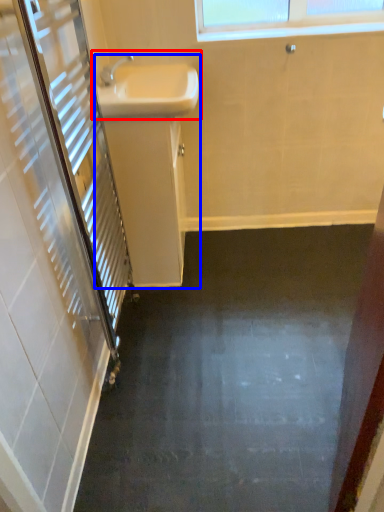
Question: Which of the following is the closest to the observer, sink (highlighted by a red box) or sink (highlighted by a blue box)?

Choices:
 (A) sink
 (B) sink

Answer: (A)